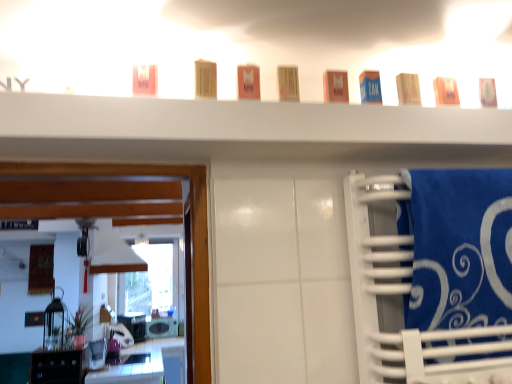
Question: From the image's perspective, would you say white glossy microwave at lower left, which appears as the second appliance when viewed from the top, is shown under matte plastic container at center, the 5th toiletry from the right?

Choices:
 (A) yes
 (B) no

Answer: (A)

Question: Is white glossy microwave at lower left, which appears as the second appliance when viewed from the top, not within matte plastic container at center, the 4th toiletry positioned from the left?

Choices:
 (A) no
 (B) yes

Answer: (B)

Question: Is white glossy microwave at lower left, which appears as the 2th appliance when viewed from the front, at the right side of matte plastic container at center, the 4th toiletry positioned from the left?

Choices:
 (A) yes
 (B) no

Answer: (B)

Question: Considering the relative sizes of white glossy microwave at lower left, which appears as the 2th appliance when viewed from the front, and matte plastic container at center, the 4th toiletry positioned from the left, in the image provided, is white glossy microwave at lower left, which appears as the 2th appliance when viewed from the front, wider than matte plastic container at center, the 4th toiletry positioned from the left,?

Choices:
 (A) yes
 (B) no

Answer: (A)

Question: Is matte plastic container at center, the 5th toiletry from the right, surrounded by white glossy microwave at lower left, the first appliance in the bottom-to-top sequence?

Choices:
 (A) yes
 (B) no

Answer: (B)

Question: From the image's perspective, relative to matte beige soap at upper right, the 2th toiletry in the right-to-left sequence, is black glossy cabinet at lower left above or below?

Choices:
 (A) above
 (B) below

Answer: (B)

Question: Is black glossy cabinet at lower left in front of or behind matte beige soap at upper right, the 2th toiletry in the right-to-left sequence, in the image?

Choices:
 (A) behind
 (B) front

Answer: (A)

Question: Is black glossy cabinet at lower left wider or thinner than matte beige soap at upper right, the 2th toiletry in the right-to-left sequence?

Choices:
 (A) thin
 (B) wide

Answer: (B)

Question: Choose the correct answer: Is black glossy cabinet at lower left inside matte beige soap at upper right, the 2th toiletry in the right-to-left sequence, or outside it?

Choices:
 (A) outside
 (B) inside

Answer: (A)

Question: Would you say metallic silver toaster at lower left, the second appliance from the bottom, is to the left or to the right of matte beige soap at upper right, the 2th toiletry in the right-to-left sequence, in the picture?

Choices:
 (A) left
 (B) right

Answer: (A)

Question: Considering the positions of point (105, 352) and point (396, 92), is point (105, 352) closer or farther from the camera than point (396, 92)?

Choices:
 (A) closer
 (B) farther

Answer: (B)

Question: Which is correct: metallic silver toaster at lower left, which appears as the first appliance when viewed from the front, is inside matte beige soap at upper right, the 2th toiletry in the right-to-left sequence, or outside of it?

Choices:
 (A) inside
 (B) outside

Answer: (B)

Question: Is metallic silver toaster at lower left, the second appliance when ordered from back to front, in front of or behind matte beige soap at upper right, the 2th toiletry in the right-to-left sequence, in the image?

Choices:
 (A) behind
 (B) front

Answer: (A)

Question: From the image's perspective, relative to white glossy microwave at lower left, which appears as the second appliance when viewed from the top, is blue cardboard box at upper center, the third toiletry from the right, above or below?

Choices:
 (A) above
 (B) below

Answer: (A)

Question: Considering their positions, is blue cardboard box at upper center, the third toiletry from the right, located in front of or behind white glossy microwave at lower left, the first appliance in the bottom-to-top sequence?

Choices:
 (A) front
 (B) behind

Answer: (A)